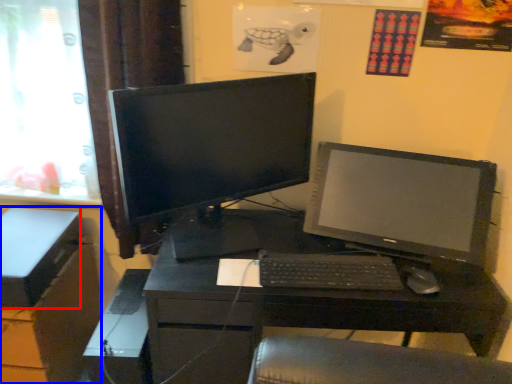
Question: Among these objects, which one is nearest to the camera, box (highlighted by a red box) or file cabinet (highlighted by a blue box)?

Choices:
 (A) box
 (B) file cabinet

Answer: (A)